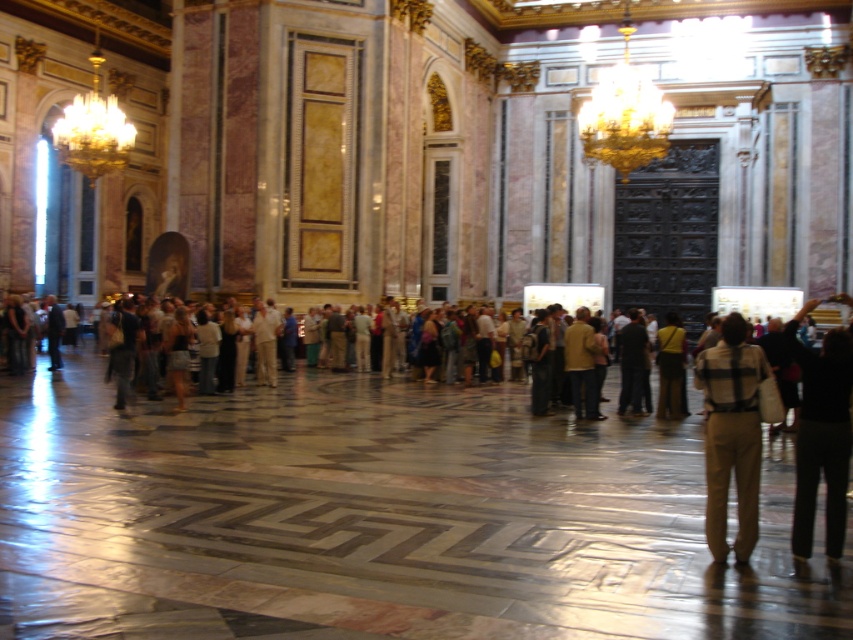
Question: Which object is farther from the camera taking this photo?

Choices:
 (A) khaki cotton pants at center
 (B) black cotton pants at lower right
 (C) brown leather backpack at center

Answer: (C)

Question: Where is khaki cotton pants at center located in relation to black cotton pants at lower right in the image?

Choices:
 (A) below
 (B) above

Answer: (A)

Question: Is black cotton pants at lower right below brown leather backpack at center?

Choices:
 (A) yes
 (B) no

Answer: (B)

Question: Which point appears farthest from the camera in this image?

Choices:
 (A) (830, 416)
 (B) (665, 348)

Answer: (B)

Question: Which object appears farthest from the camera in this image?

Choices:
 (A) brown leather backpack at center
 (B) black cotton pants at lower right

Answer: (A)

Question: Can you confirm if black cotton pants at lower right is bigger than brown leather backpack at center?

Choices:
 (A) yes
 (B) no

Answer: (A)